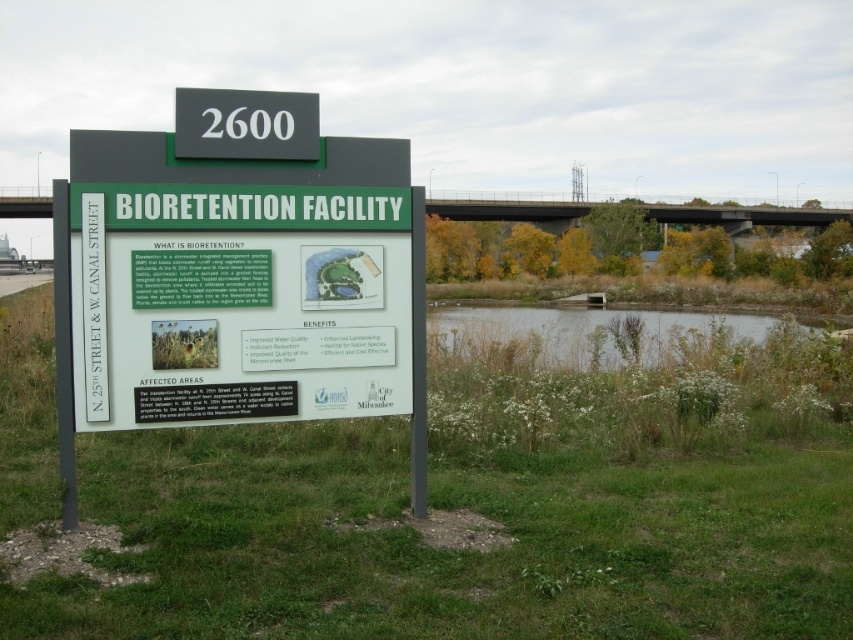
You are standing in front of the signboard at the bioretention facility. You notice the green grass at center and the green plastic sign at center. Which object is taller?

The green plastic sign at center is taller than the green grass at center.

You are standing in front of the bioretention facility signboard. There is green grass at center and green plastic sign at center. Which object is positioned lower in the image?

The green grass at center is located below the green plastic sign at center, so the green grass at center is positioned lower in the image.

You are standing in front of the signboard near the retention pond. There is a point marked at coordinates (450, 552) on the signboard. What does this point indicate?

The point at coordinates (450, 552) indicates green grass at center.